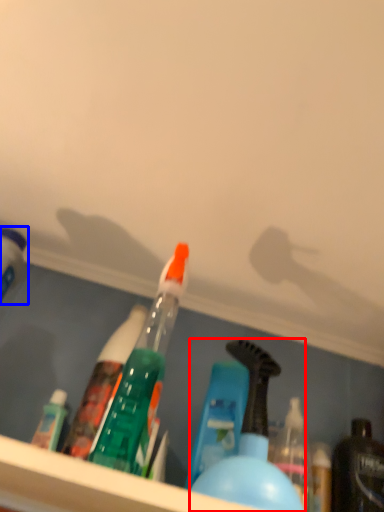
Question: Which of the following is the closest to the observer, bottle (highlighted by a red box) or bottle (highlighted by a blue box)?

Choices:
 (A) bottle
 (B) bottle

Answer: (A)